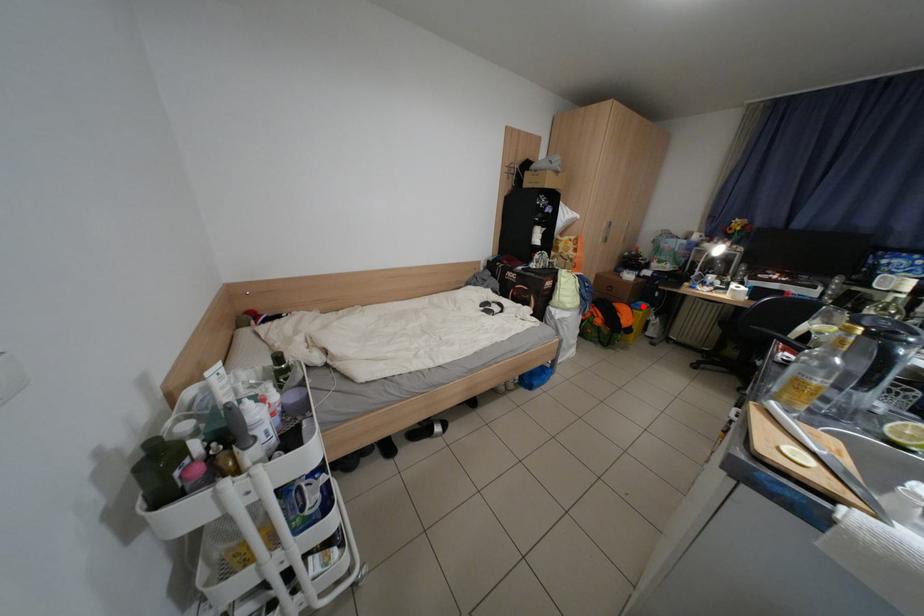
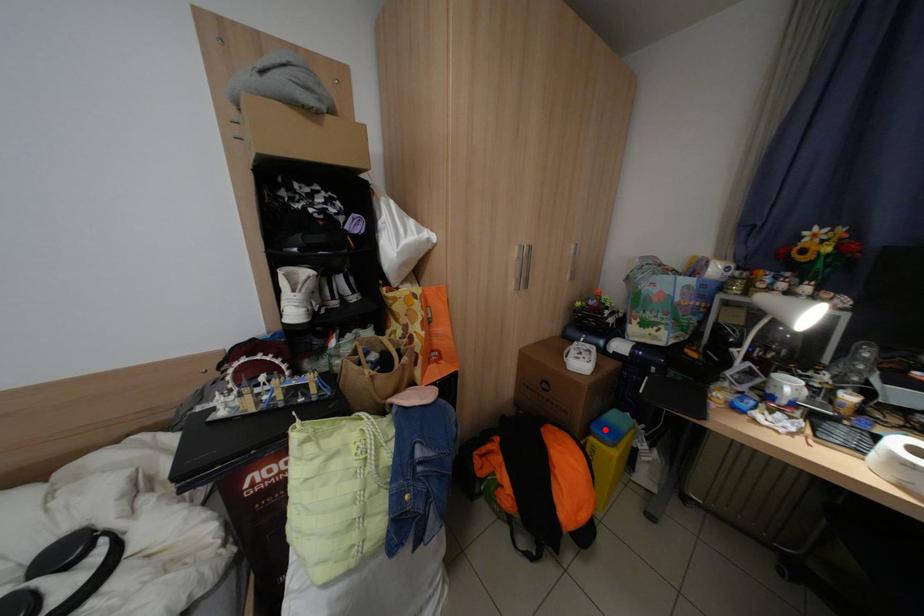
I am providing you with two images of the same scene from different viewpoints. A red point is marked on the first image and another point is marked on the second image. Do the highlighted points in image1 and image2 indicate the same real-world spot?

Yes